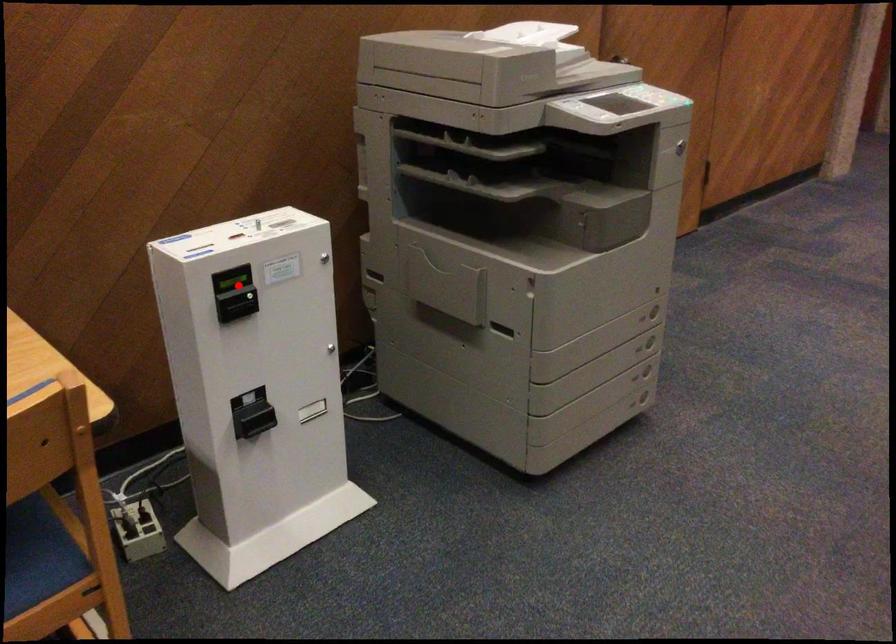
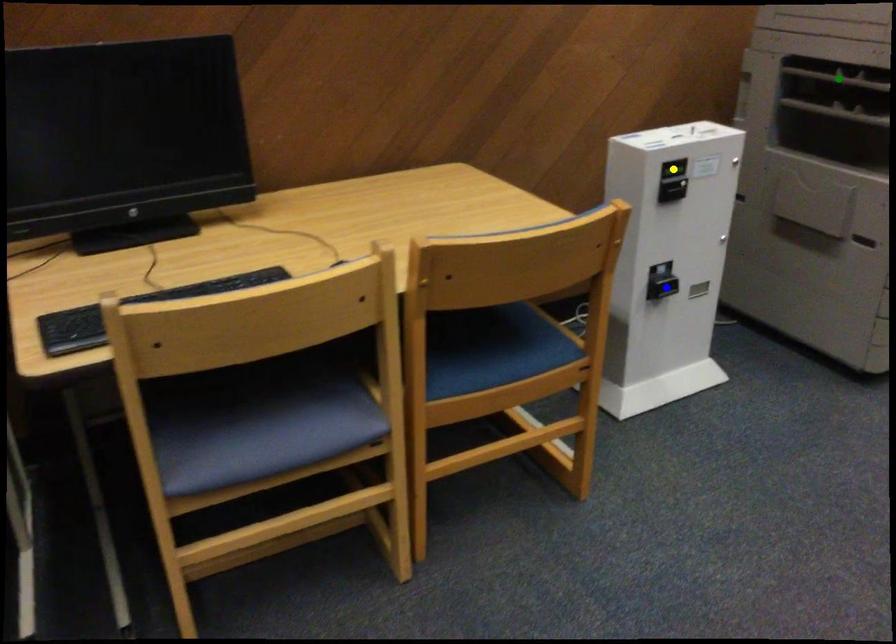
Question: I am providing you with two images of the same scene from different viewpoints. A red point is marked on the first image. You are given multiple points on the second image. In image 2, which mark is for the same physical point as the one in image 1?

Choices:
 (A) blue point
 (B) yellow point
 (C) green point

Answer: (B)